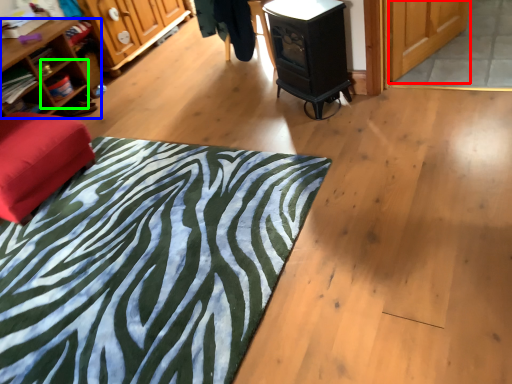
Question: Based on their relative distances, which object is nearer to screen door (highlighted by a red box)? Choose from shelf (highlighted by a blue box) and shelf (highlighted by a green box).

Choices:
 (A) shelf
 (B) shelf

Answer: (A)